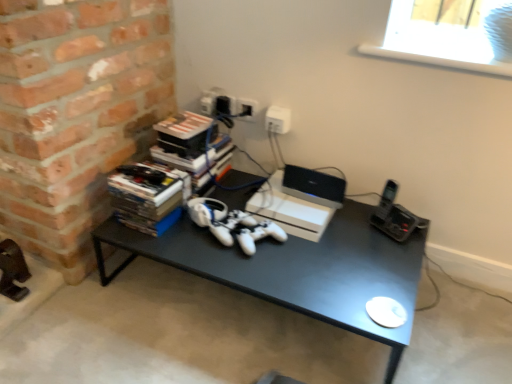
Locate an element on the screen. blank space above white matte gaming console at center (from a real-world perspective) is located at coordinates (289, 197).